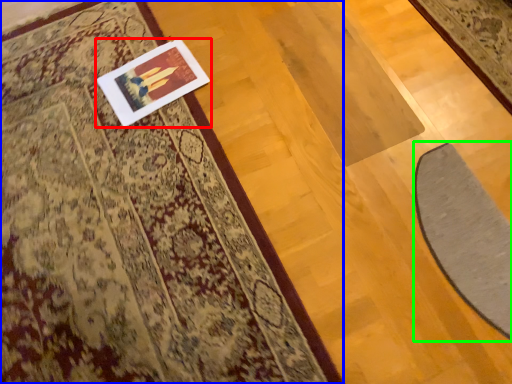
Question: Based on their relative distances, which object is farther from picture frame (highlighted by a red box)? Choose from mat (highlighted by a blue box) and doormat (highlighted by a green box).

Choices:
 (A) mat
 (B) doormat

Answer: (B)